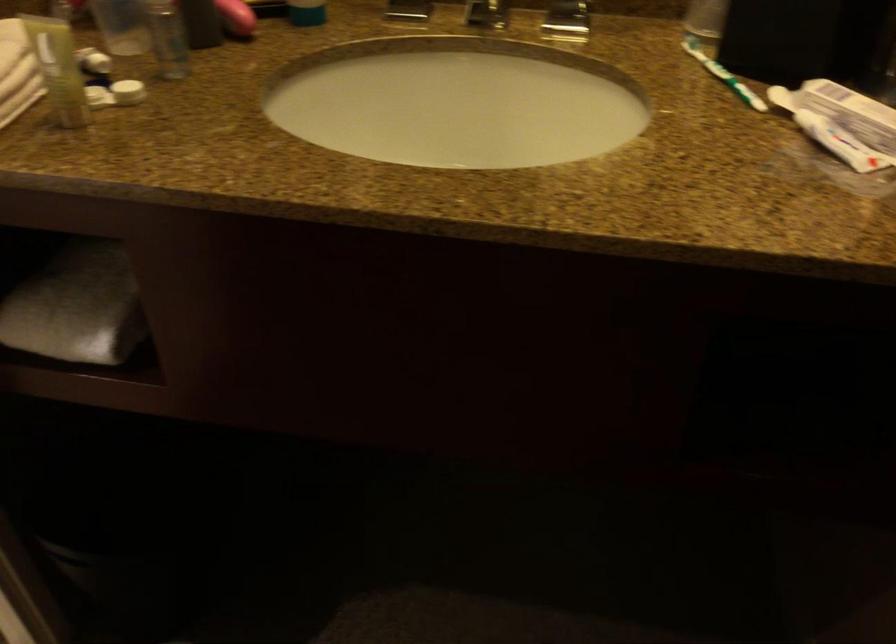
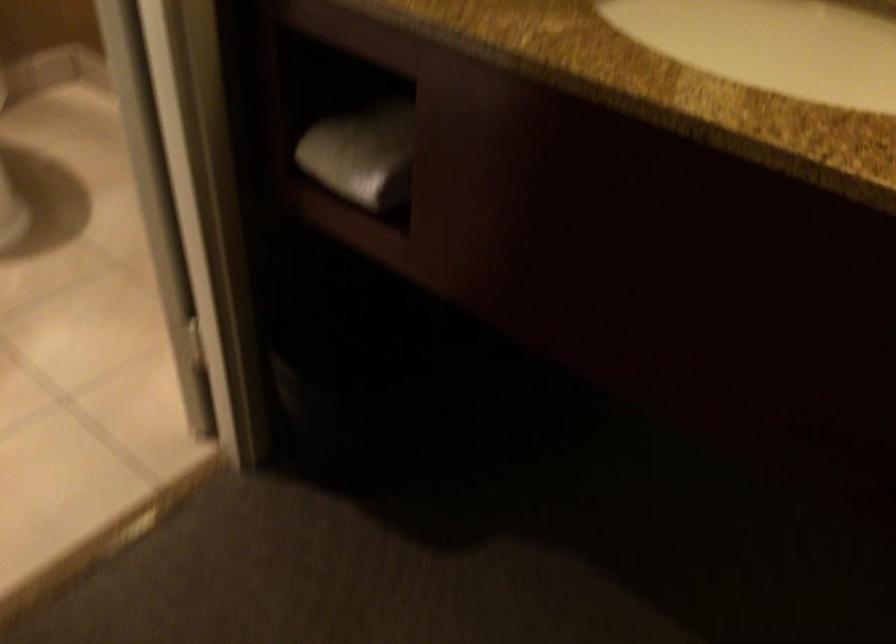
Based on the photo, which direction would the cameraman need to move to produce the second image?

The cameraman moved toward right, forward.